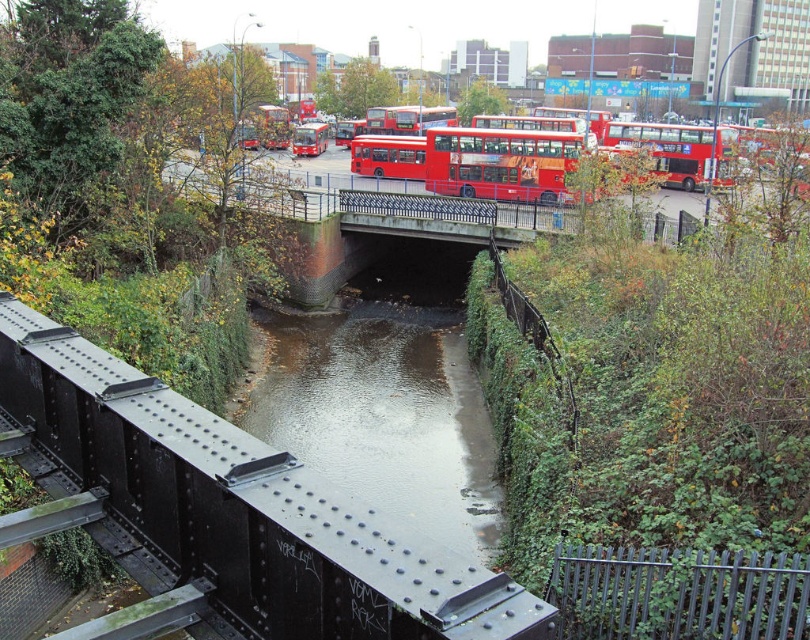
Question: Is red matte double-decker bus at center above matte red bus at center?

Choices:
 (A) no
 (B) yes

Answer: (A)

Question: Which of the following is the farthest from the observer?

Choices:
 (A) red matte double-decker bus at center
 (B) matte red bus at center

Answer: (B)

Question: Is the position of red matte double-decker bus at center less distant than that of matte red bus at center?

Choices:
 (A) yes
 (B) no

Answer: (A)

Question: Can you confirm if red matte double-decker bus at center is positioned above matte red bus at center?

Choices:
 (A) yes
 (B) no

Answer: (B)